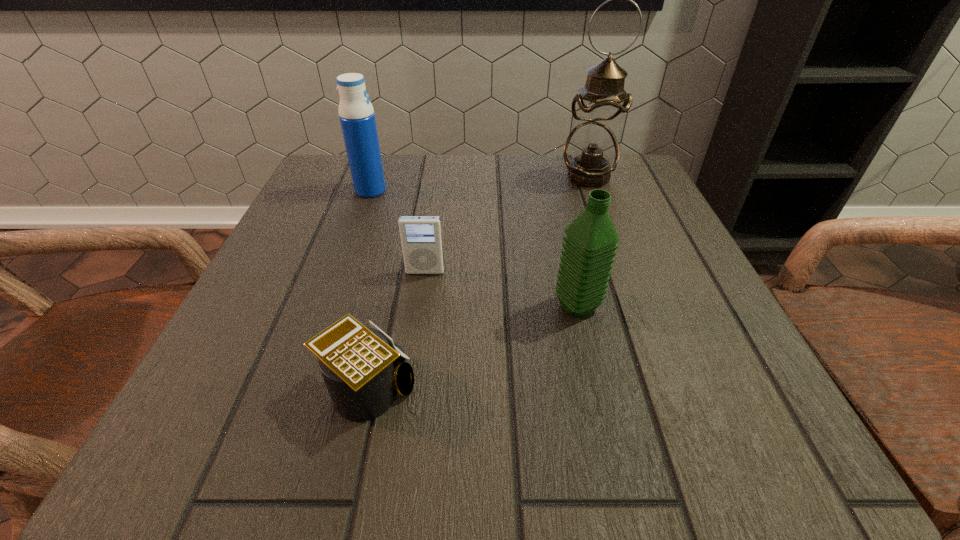
This screenshot has width=960, height=540. I want to click on the tallest object, so click(x=591, y=152).

The image size is (960, 540). I want to click on the farther water bottle, so click(356, 113).

At what (x,y) coordinates should I click in order to perform the action: click on the shorter water bottle. Please return your answer as a coordinate pair (x, y). Looking at the image, I should click on (590, 242).

The height and width of the screenshot is (540, 960). Find the location of `the nearer water bottle`. the nearer water bottle is located at coordinates (590, 242).

Image resolution: width=960 pixels, height=540 pixels. I want to click on the second shortest object, so click(421, 238).

Find the location of a particular element. The image size is (960, 540). iPod is located at coordinates (421, 238).

You are a GUI agent. You are given a task and a screenshot of the screen. Output one action in this format:
    pyautogui.click(x=<x>, y=<y>)
    Task: Click on the nearest object
    The image size is (960, 540).
    Given the screenshot: What is the action you would take?
    pyautogui.click(x=363, y=370)

Find the location of a particular element. the shortest object is located at coordinates (363, 370).

Find the location of a particular element. The image size is (960, 540). free space located on the left of the oil lamp is located at coordinates (450, 177).

Find the location of a particular element. The image size is (960, 540). free space located on the right of the left water bottle is located at coordinates (409, 190).